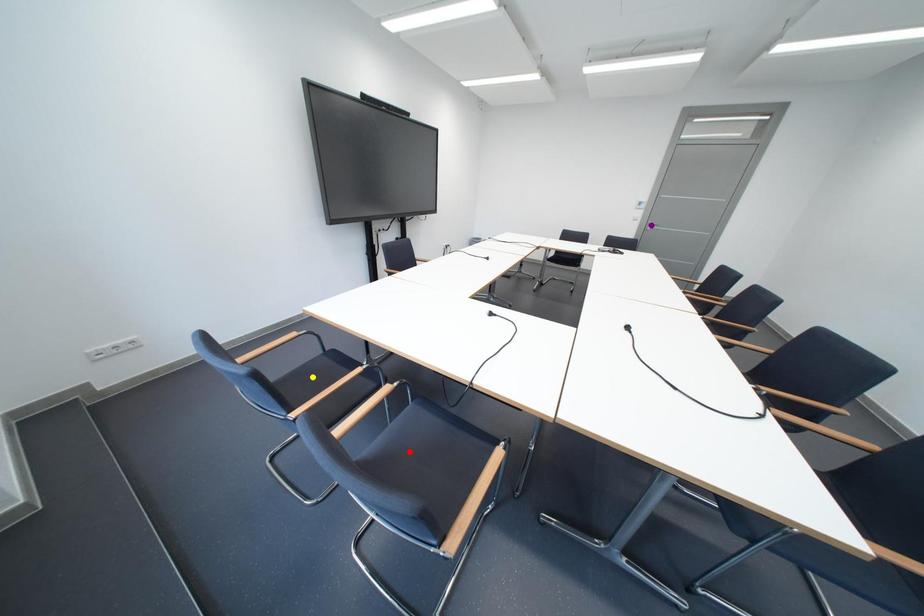
Order these from nearest to farthest:
purple point | red point | yellow point

red point
yellow point
purple point